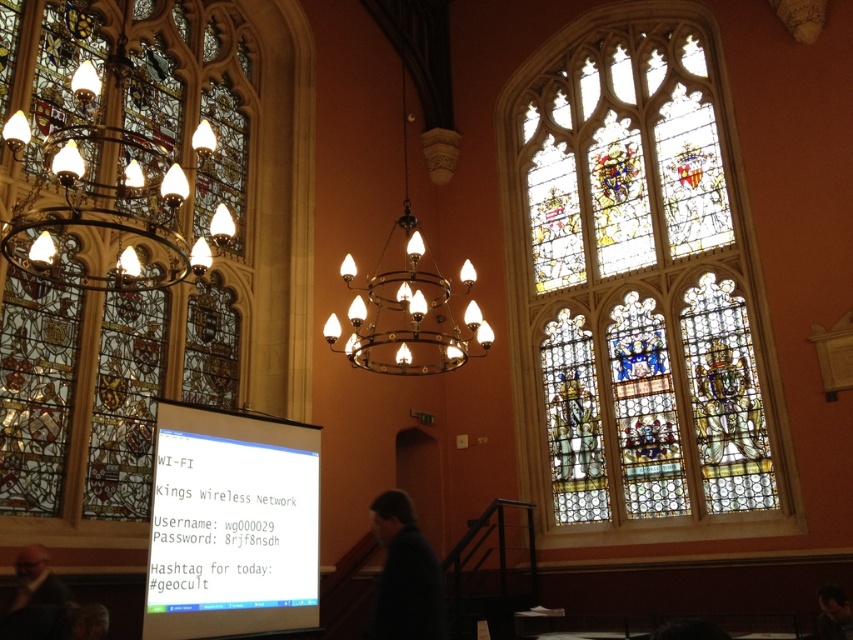
You are a guest at a formal event in this grand hall. You see the dark blue jacket at center and the dark brown leather jacket at lower left. Which jacket is closer to the floor?

The dark blue jacket at center is below dark brown leather jacket at lower left, so the dark blue jacket at center is closer to the floor.

You are an event planner setting up a presentation in the grand hall. You need to position a projector so it can project onto the white glossy projection screen at lower left without casting shadows from the matte brass chandelier at center. Where should you place the projector relative to the screen?

The white glossy projection screen at lower left is closer to the viewer than the matte brass chandelier at center. To avoid shadows from the chandelier, the projector should be placed behind the screen, projecting towards the chandelier side. This way, the light will pass between the screen and chandelier, minimizing shadow obstruction.

You are standing in the grand hall and want to locate the white glossy projection screen at lower left. According to the coordinates provided, where exactly is it positioned?

The white glossy projection screen at lower left is positioned at point 0.820 on the x axis and 0.272 on the y axis.